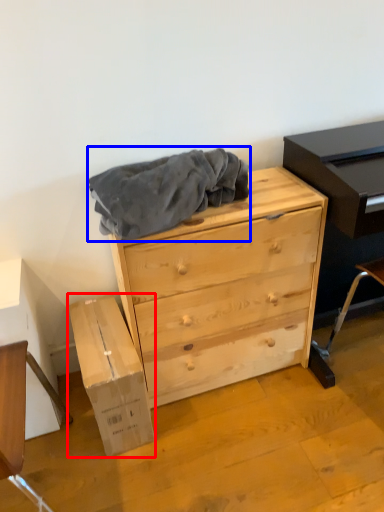
Question: Which point is closer to the camera, cardboard box (highlighted by a red box) or clothing (highlighted by a blue box)?

Choices:
 (A) cardboard box
 (B) clothing

Answer: (B)